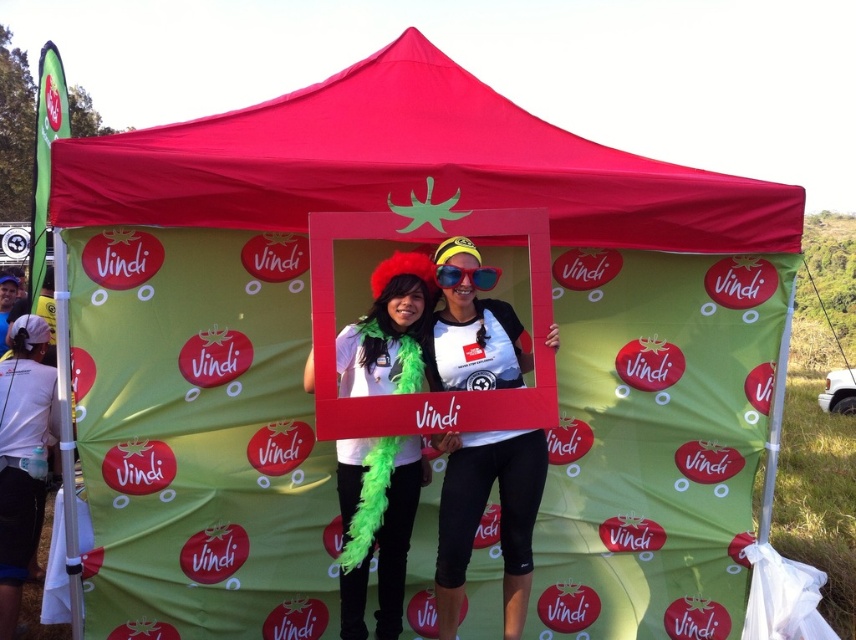
Question: Is matte red canopy at center bigger than matte white shirt at left?

Choices:
 (A) yes
 (B) no

Answer: (A)

Question: Is white matte t-shirt at center further to the viewer compared to white matte feather boa at center?

Choices:
 (A) yes
 (B) no

Answer: (A)

Question: From the image, what is the correct spatial relationship of white matte feather boa at center in relation to matte white shirt at left?

Choices:
 (A) above
 (B) below

Answer: (B)

Question: Considering the real-world distances, which object is farthest from the white matte feather boa at center?

Choices:
 (A) blue reflective sunglasses at center
 (B) white matte t-shirt at center
 (C) matte white shirt at left

Answer: (C)

Question: Which of the following is the farthest from the observer?

Choices:
 (A) matte red canopy at center
 (B) matte white shirt at left
 (C) blue reflective sunglasses at center

Answer: (B)

Question: Which object is farther from the camera taking this photo?

Choices:
 (A) white matte feather boa at center
 (B) matte red canopy at center
 (C) matte white shirt at left

Answer: (C)